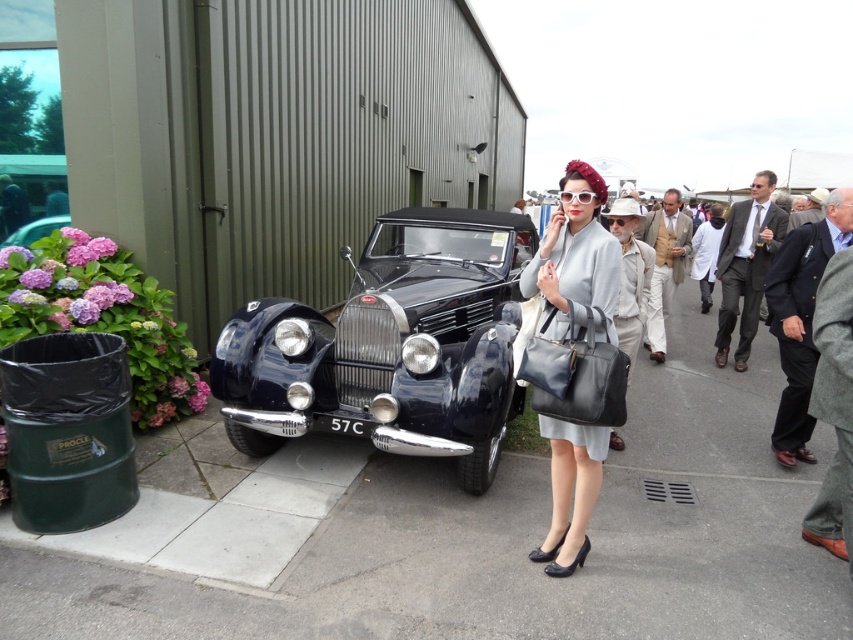
Can you confirm if dark blue suit at right is positioned to the left of light beige fabric suit at center?

No, dark blue suit at right is not to the left of light beige fabric suit at center.

This screenshot has width=853, height=640. In order to click on dark blue suit at right in this screenshot , I will do `click(801, 317)`.

Who is more distant from viewer, (x=834, y=200) or (x=648, y=220)?

The point (x=648, y=220) is more distant.

This screenshot has height=640, width=853. In order to click on dark blue suit at right in this screenshot , I will do `click(801, 317)`.

Which of these two, matte gray dress at center or light beige fabric suit at center, stands shorter?

matte gray dress at center

Can you confirm if matte gray dress at center is thinner than light beige fabric suit at center?

Correct, matte gray dress at center's width is less than light beige fabric suit at center's.

Who is more forward, (608,310) or (666,273)?

Point (608,310)

The width and height of the screenshot is (853, 640). I want to click on matte gray dress at center, so click(x=573, y=358).

Between light beige fabric briefcase at center and light brown suit at center, which one has more height?

light brown suit at center

Based on the photo, can you confirm if light beige fabric briefcase at center is taller than light brown suit at center?

Incorrect, light beige fabric briefcase at center's height is not larger of light brown suit at center's.

Is point (611, 440) positioned before point (799, 211)?

Yes, it is.

Find the location of a particular element. This screenshot has width=853, height=640. light beige fabric briefcase at center is located at coordinates (630, 275).